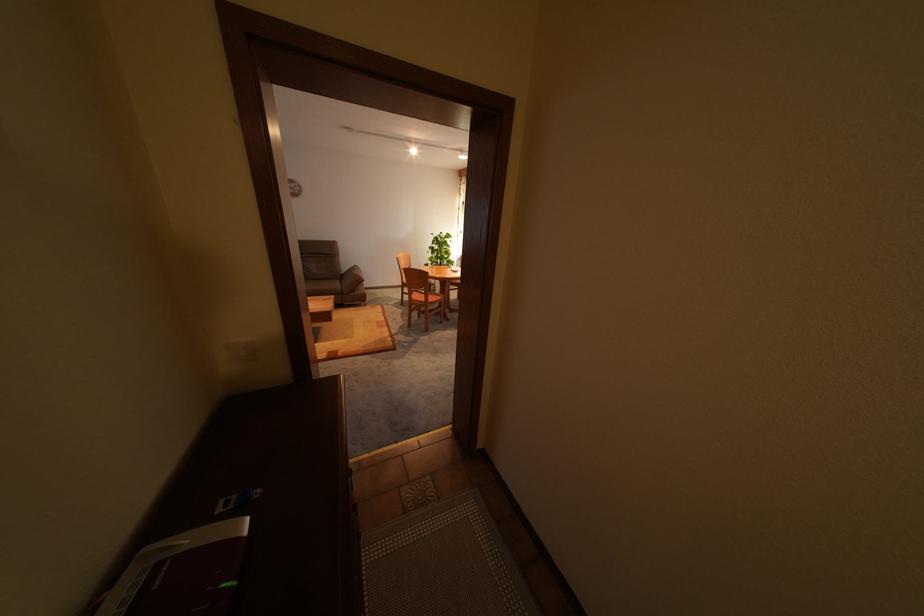
The location [440,249] corresponds to which object?

It corresponds to the potted green plant in the image.